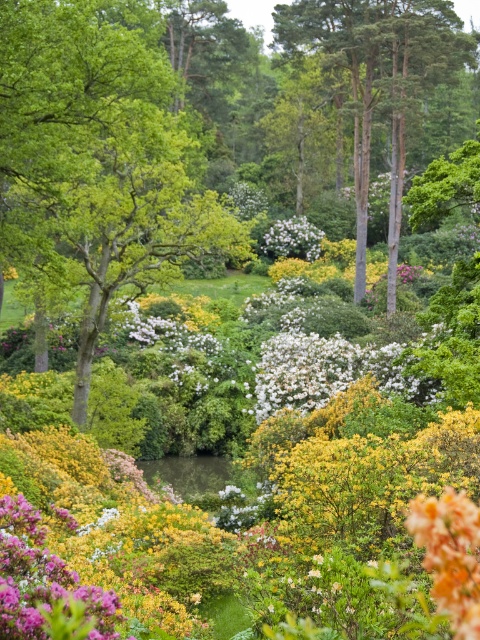
Is purple matte flower at center closer to camera compared to orange textured flower at lower right?

Yes, it is.

Does purple matte flower at center have a greater width compared to orange textured flower at lower right?

Correct, the width of purple matte flower at center exceeds that of orange textured flower at lower right.

Find the location of `purple matte flower at center`. purple matte flower at center is located at coordinates (45, 584).

Looking at this image, between smooth bark tree at upper center and white matte flower at center, which one is positioned higher?

smooth bark tree at upper center is higher up.

Is point (343, 4) farther from viewer compared to point (276, 240)?

No, (343, 4) is in front of (276, 240).

Which is behind, point (460, 22) or point (315, 230)?

The point (315, 230) is more distant.

This screenshot has width=480, height=640. I want to click on smooth bark tree at upper center, so click(377, 81).

Who is shorter, purple matte flower at center or white matte flower at center?

white matte flower at center

Does purple matte flower at center have a greater width compared to white matte flower at center?

Yes.

Is point (8, 493) positioned after point (307, 252)?

No, (8, 493) is closer to viewer.

This screenshot has height=640, width=480. I want to click on purple matte flower at center, so click(x=45, y=584).